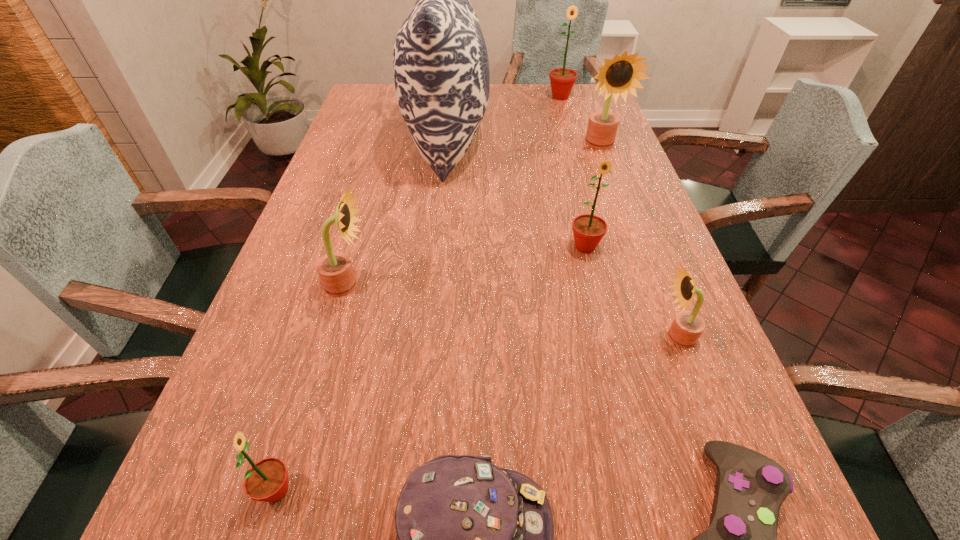
This screenshot has height=540, width=960. I want to click on cushion, so click(441, 72).

Find the location of `the tallest object`. the tallest object is located at coordinates (441, 72).

Identify the location of the second farthest sunflower. The image size is (960, 540). (620, 75).

This screenshot has height=540, width=960. In order to click on the farthest yellow sunflower in this screenshot , I will do `click(620, 75)`.

Where is `the farthest sunflower`? The image size is (960, 540). the farthest sunflower is located at coordinates (562, 80).

At what (x,y) coordinates should I click in order to perform the action: click on the farthest green sunflower. Please return your answer as a coordinate pair (x, y). Looking at the image, I should click on (562, 80).

Where is `the leftmost yellow sunflower`? the leftmost yellow sunflower is located at coordinates (335, 269).

Locate an element on the screen. Image resolution: width=960 pixels, height=540 pixels. the third nearest sunflower is located at coordinates (335, 269).

Identify the location of the fourth farthest object. (588, 230).

Locate an element on the screen. the second biggest green sunflower is located at coordinates (588, 230).